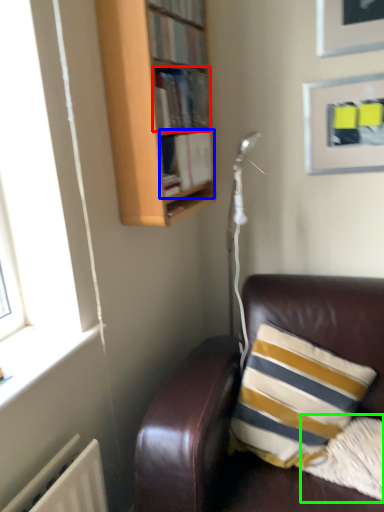
Question: Which object is the closest to the book (highlighted by a red box)? Choose among these: book (highlighted by a blue box) or pillow (highlighted by a green box).

Choices:
 (A) book
 (B) pillow

Answer: (A)